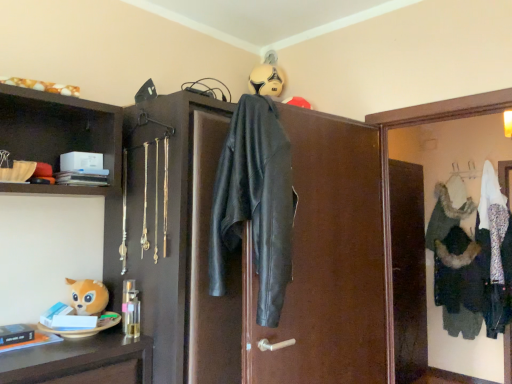
Question: Is white fur coat at center not inside black leather jacket at center?

Choices:
 (A) yes
 (B) no

Answer: (A)

Question: Does white fur coat at center come behind black leather jacket at center?

Choices:
 (A) yes
 (B) no

Answer: (A)

Question: From a real-world perspective, does white fur coat at center stand above black leather jacket at center?

Choices:
 (A) no
 (B) yes

Answer: (A)

Question: Does white fur coat at center appear on the left side of black leather jacket at center?

Choices:
 (A) no
 (B) yes

Answer: (A)

Question: Does white fur coat at center have a smaller size compared to black leather jacket at center?

Choices:
 (A) no
 (B) yes

Answer: (B)

Question: From a real-world perspective, is white fur coat at center located beneath black leather jacket at center?

Choices:
 (A) no
 (B) yes

Answer: (B)

Question: Does black leather jacket at center have a lesser height compared to black leather jacket at center?

Choices:
 (A) no
 (B) yes

Answer: (B)

Question: Considering the relative positions of black leather jacket at center and black leather jacket at center in the image provided, is black leather jacket at center to the left of black leather jacket at center from the viewer's perspective?

Choices:
 (A) yes
 (B) no

Answer: (A)

Question: Is black leather jacket at center to the right of black leather jacket at center from the viewer's perspective?

Choices:
 (A) no
 (B) yes

Answer: (A)

Question: Is black leather jacket at center positioned in front of black leather jacket at center?

Choices:
 (A) no
 (B) yes

Answer: (B)

Question: Is black leather jacket at center at the back of black leather jacket at center?

Choices:
 (A) no
 (B) yes

Answer: (B)

Question: From a real-world perspective, is black leather jacket at center physically below black leather jacket at center?

Choices:
 (A) no
 (B) yes

Answer: (A)

Question: Is white fur coat at center further to camera compared to white fabric medicine cabinet at upper right?

Choices:
 (A) no
 (B) yes

Answer: (B)